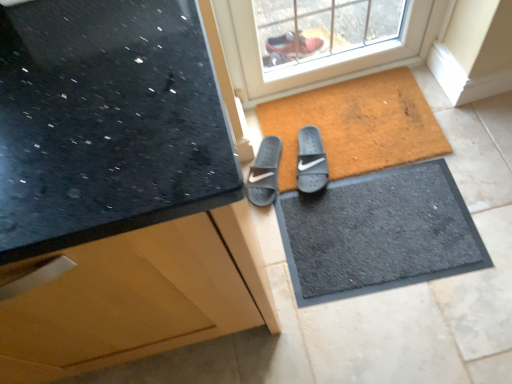
At what (x,y) coordinates should I click in order to perform the action: click on vacant space situated above black rubber doormat at center (from a real-world perspective). Please return your answer as a coordinate pair (x, y). The width and height of the screenshot is (512, 384). Looking at the image, I should click on (x=378, y=226).